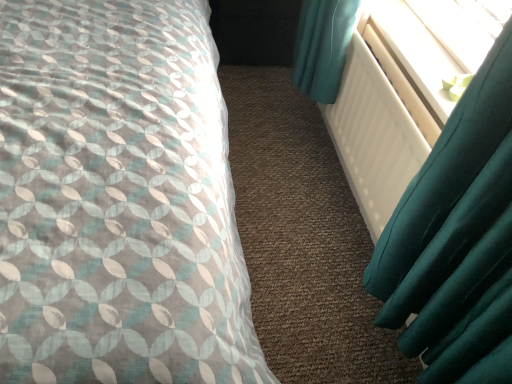
Question: Would you say white matte radiator at right is inside or outside patterned fabric bed at left?

Choices:
 (A) outside
 (B) inside

Answer: (A)

Question: Is point (413, 172) positioned closer to the camera than point (1, 125)?

Choices:
 (A) closer
 (B) farther

Answer: (B)

Question: Based on their relative distances, which object is farther from the white matte radiator at right?

Choices:
 (A) black matte box at center
 (B) patterned fabric bed at left
 (C) white plastic radiator at upper right

Answer: (A)

Question: Which object is positioned closest to the patterned fabric bed at left?

Choices:
 (A) white matte radiator at right
 (B) white plastic radiator at upper right
 (C) black matte box at center

Answer: (A)